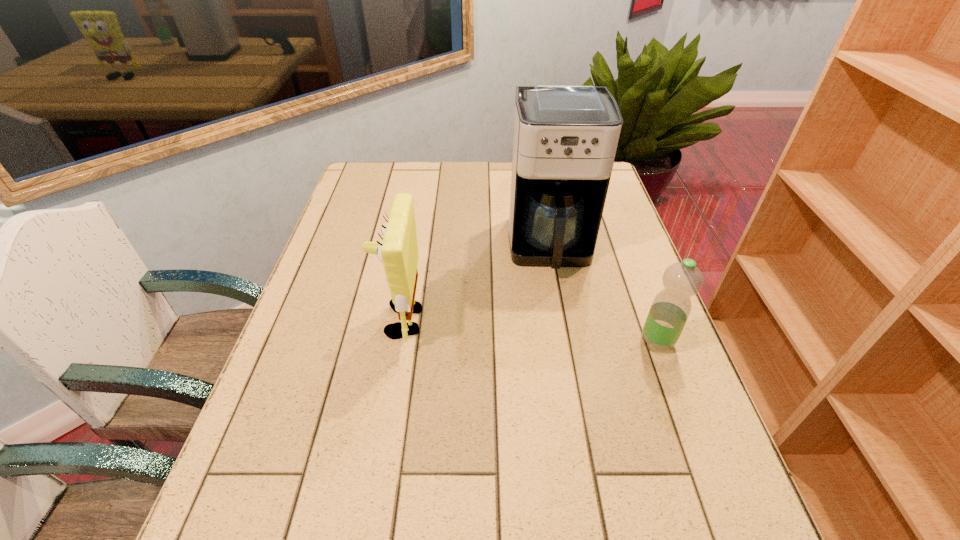
I want to click on the leftmost object, so coord(398,251).

Locate an element on the screen. the second tallest object is located at coordinates (398, 251).

Where is `the shortest object`? the shortest object is located at coordinates (670, 309).

Locate an element on the screen. Image resolution: width=960 pixels, height=540 pixels. the rightmost object is located at coordinates (670, 309).

At what (x,y) coordinates should I click in order to perform the action: click on the farthest object. Please return your answer as a coordinate pair (x, y). Looking at the image, I should click on (565, 139).

At what (x,y) coordinates should I click in order to perform the action: click on the second object from left to right. Please return your answer as a coordinate pair (x, y). The height and width of the screenshot is (540, 960). Looking at the image, I should click on (565, 139).

Image resolution: width=960 pixels, height=540 pixels. What are the coordinates of `vacant space located on the face of the leftmost object` in the screenshot? It's located at (317, 321).

At what (x,y) coordinates should I click in order to perform the action: click on vacant space located 0.180m on the face of the leftmost object. Please return your answer as a coordinate pair (x, y). The width and height of the screenshot is (960, 540). Looking at the image, I should click on (304, 321).

Identify the location of free space located 0.170m on the face of the leftmost object. This screenshot has width=960, height=540. (308, 321).

Find the location of a particular element. The height and width of the screenshot is (540, 960). blank area located 0.300m on the left of the rightmost object is located at coordinates (512, 342).